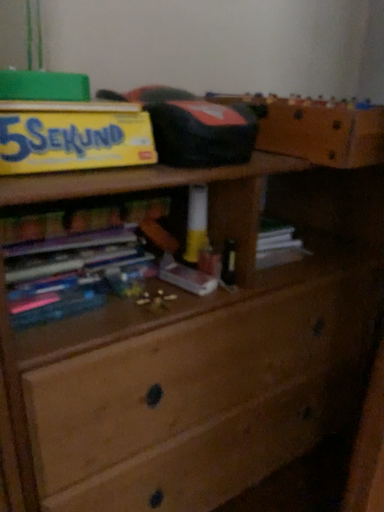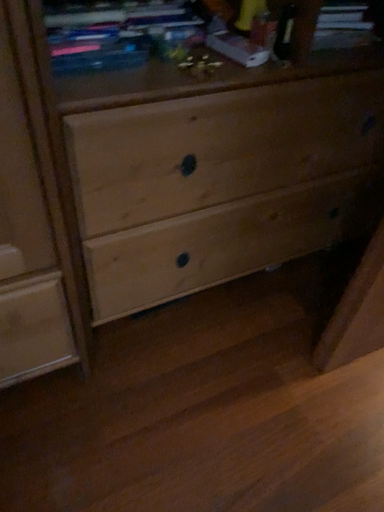
Question: Which way did the camera rotate in the video?

Choices:
 (A) rotated left
 (B) rotated right

Answer: (A)